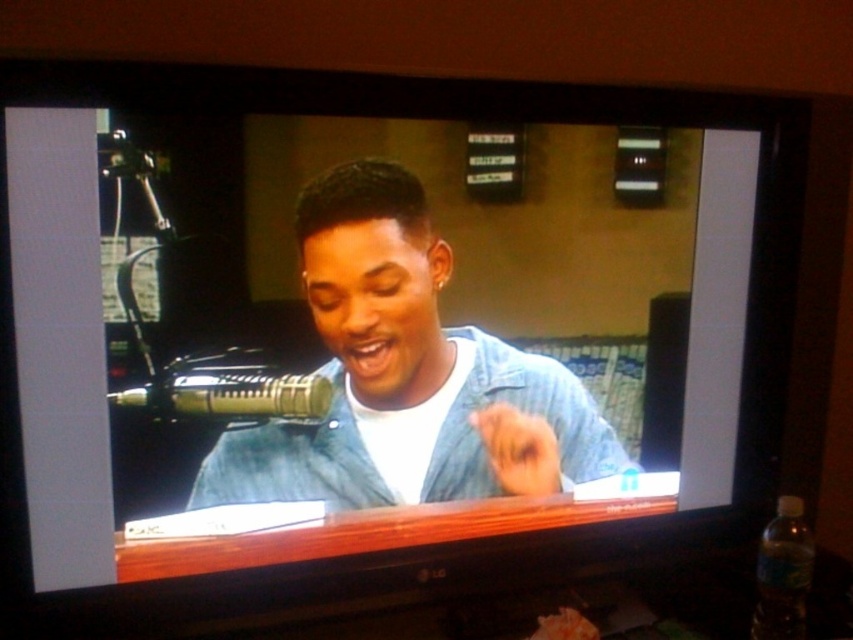
Question: Which object appears farthest from the camera in this image?

Choices:
 (A) metallic gold microphone at left
 (B) denim shirt at center

Answer: (B)

Question: Does denim shirt at center have a lesser width compared to metallic gold microphone at left?

Choices:
 (A) yes
 (B) no

Answer: (B)

Question: Considering the relative positions of denim shirt at center and metallic gold microphone at left in the image provided, where is denim shirt at center located with respect to metallic gold microphone at left?

Choices:
 (A) below
 (B) above

Answer: (A)

Question: Among these points, which one is farthest from the camera?

Choices:
 (A) (566, 381)
 (B) (216, 369)

Answer: (A)

Question: Among these points, which one is farthest from the camera?

Choices:
 (A) (357, 474)
 (B) (181, 378)

Answer: (A)

Question: Can you confirm if denim shirt at center is positioned below metallic gold microphone at left?

Choices:
 (A) yes
 (B) no

Answer: (A)